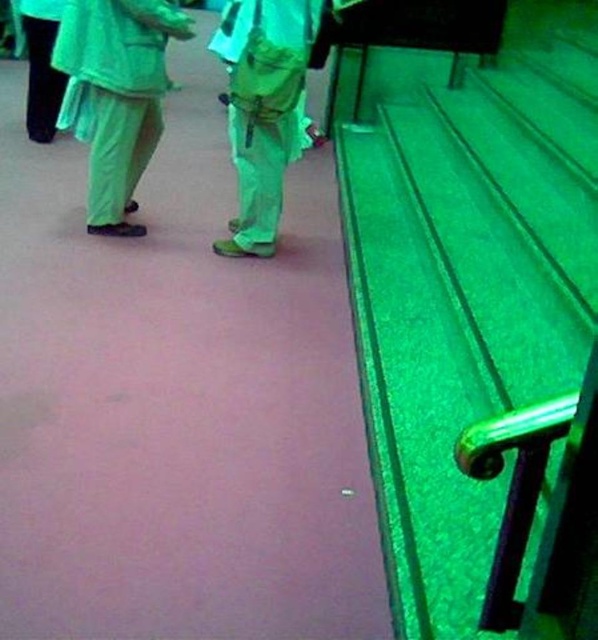
Find the location of a particular element. green fabric pants at left is located at coordinates pos(115,96).

Can you confirm if green fabric pants at left is positioned above matte green pants at center?

Yes.

The image size is (598, 640). I want to click on green fabric pants at left, so click(x=115, y=96).

Where is `green fabric pants at left`? The height and width of the screenshot is (640, 598). green fabric pants at left is located at coordinates (115, 96).

Does matte green pants at center appear under black matte pants at left?

Yes.

Who is shorter, matte green pants at center or black matte pants at left?

black matte pants at left

Image resolution: width=598 pixels, height=640 pixels. I want to click on matte green pants at center, so click(x=263, y=108).

This screenshot has width=598, height=640. Identify the location of matte green pants at center. (263, 108).

Between point (398, 102) and point (41, 134), which one is positioned behind?

Point (398, 102)

Based on the photo, who is lower down, green textured stair at right or black matte pants at left?

Positioned lower is green textured stair at right.

What do you see at coordinates (465, 276) in the screenshot? I see `green textured stair at right` at bounding box center [465, 276].

The height and width of the screenshot is (640, 598). Identify the location of green textured stair at right. (465, 276).